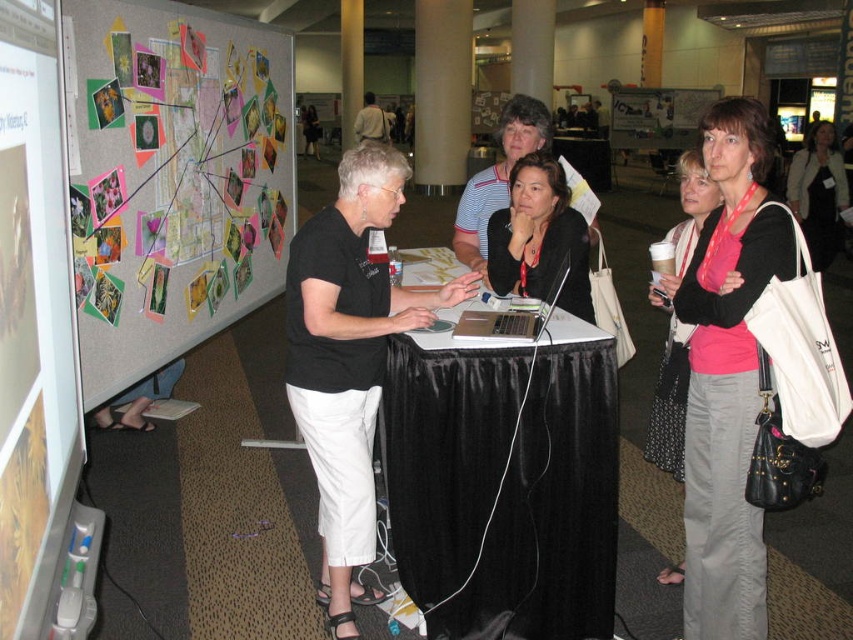
You are attending a conference and need to identify which attendee is taller between the black matte shirt at center and the striped cotton shirt at center. Based on the scene, which one is taller?

The black matte shirt at center is taller than the striped cotton shirt at center according to the description.

You are standing at the entrance of the conference room and see the scene described. You need to locate the pink fabric shirt at center. Based on the coordinates provided in the Objects Description, can you determine its position relative to the table?

The pink fabric shirt at center is located at coordinates point (727, 374). Since the coordinates are relative to the image frame, the pink fabric shirt at center is positioned near the lower middle area of the image, likely close to the table where the woman is standing.

You are a photographer standing at the center of the room. You want to take a photo of the multicolored paper collage at left so that it is centered in the frame. Where should you position yourself relative to the table?

The multicolored paper collage at left is located at coordinates point (172, 177). To center it in the frame, you should position yourself directly facing the point where the collage is placed, ensuring your camera is aligned with its coordinates.